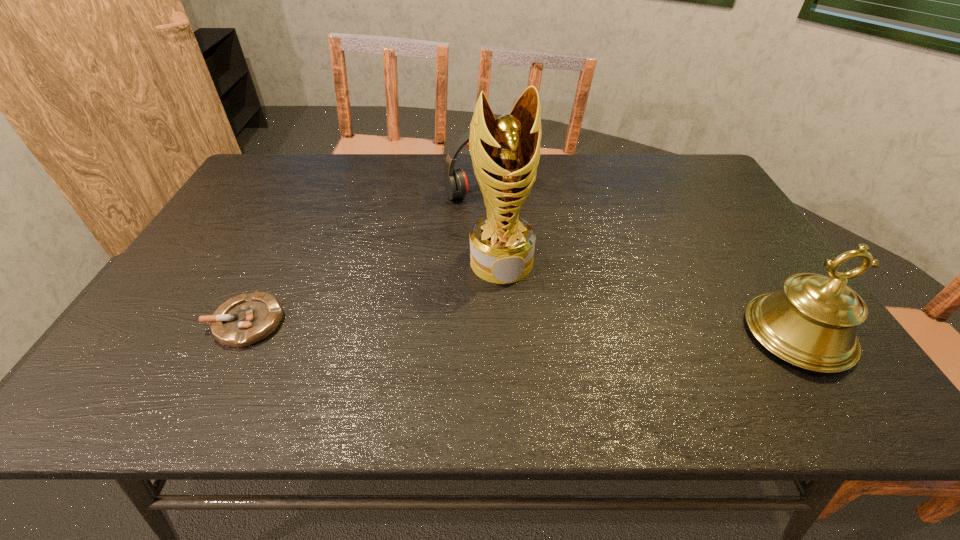
The image size is (960, 540). What are the coordinates of `the closest object relative to the award` in the screenshot? It's located at pyautogui.click(x=455, y=180).

Where is `vacant point that satisfies the following two spatial constraints: 1. on the front side of the second shortest object; 2. on the left side of the tallest object`? The image size is (960, 540). vacant point that satisfies the following two spatial constraints: 1. on the front side of the second shortest object; 2. on the left side of the tallest object is located at coordinates (488, 262).

Locate an element on the screen. free space that satisfies the following two spatial constraints: 1. on the front side of the earphone; 2. on the right side of the bell is located at coordinates (489, 334).

The height and width of the screenshot is (540, 960). Find the location of `free spot that satisfies the following two spatial constraints: 1. on the back side of the ashtray; 2. on the right side of the third nearest object`. free spot that satisfies the following two spatial constraints: 1. on the back side of the ashtray; 2. on the right side of the third nearest object is located at coordinates (276, 262).

Identify the location of vacant area in the image that satisfies the following two spatial constraints: 1. on the back side of the shortest object; 2. on the left side of the farthest object. (312, 190).

Where is `free space that satisfies the following two spatial constraints: 1. on the front side of the earphone; 2. on the left side of the rightmost object`? free space that satisfies the following two spatial constraints: 1. on the front side of the earphone; 2. on the left side of the rightmost object is located at coordinates (489, 334).